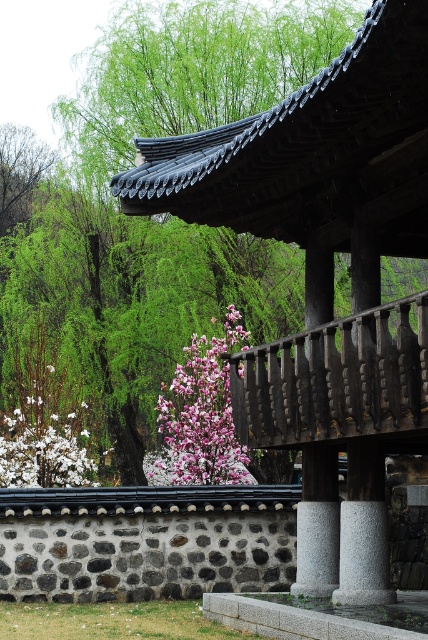
Question: Is pink glossy flower at center to the right of white matte flower at lower left from the viewer's perspective?

Choices:
 (A) no
 (B) yes

Answer: (B)

Question: Can you confirm if pink glossy flower at center is bigger than white matte flower at lower left?

Choices:
 (A) no
 (B) yes

Answer: (A)

Question: Which object is farther from the camera taking this photo?

Choices:
 (A) white matte flower at lower left
 (B) pink glossy flower at center

Answer: (B)

Question: Does pink glossy flower at center appear on the left side of white matte flower at lower left?

Choices:
 (A) yes
 (B) no

Answer: (B)

Question: Which point is closer to the camera?

Choices:
 (A) (74, 465)
 (B) (219, 413)

Answer: (B)